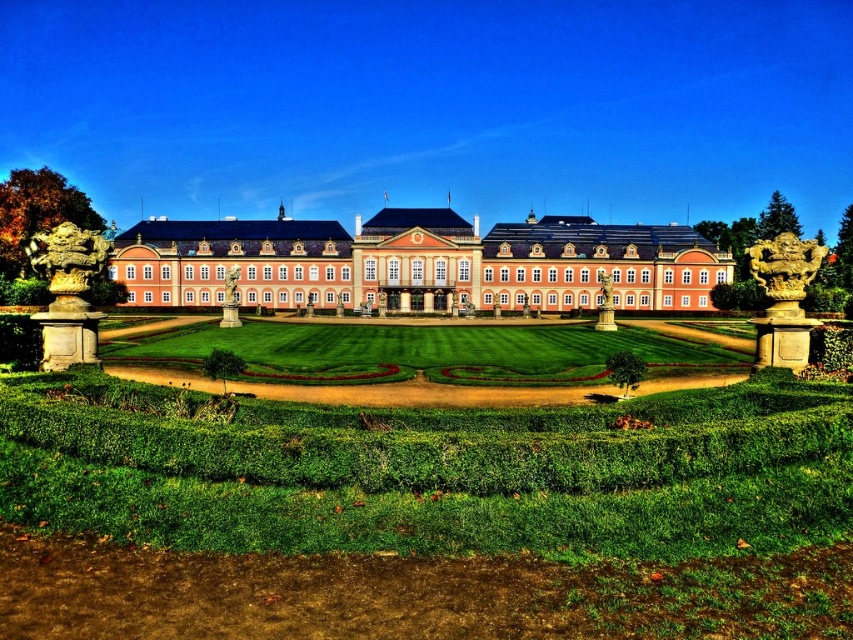
Who is higher up, green grass at center or matte pink building at center?

Positioned higher is matte pink building at center.

Is green grass at center further to the viewer compared to matte pink building at center?

No.

Is point (793, 480) farther from camera compared to point (170, 266)?

No.

The width and height of the screenshot is (853, 640). What are the coordinates of `green grass at center` in the screenshot? It's located at (430, 472).

Can you confirm if matte pink building at center is thinner than green leafy hedge at center?

No, matte pink building at center is not thinner than green leafy hedge at center.

Between matte pink building at center and green leafy hedge at center, which one appears on the right side from the viewer's perspective?

Positioned to the right is green leafy hedge at center.

Which is behind, point (183, 272) or point (740, 296)?

Point (183, 272)

Locate an element on the screen. Image resolution: width=853 pixels, height=640 pixels. matte pink building at center is located at coordinates coord(419,262).

Who is shorter, green grass at center or green leafy hedge at center?

With less height is green leafy hedge at center.

Is point (120, 584) closer to viewer compared to point (750, 296)?

Yes, it is in front of point (750, 296).

This screenshot has width=853, height=640. I want to click on green grass at center, so click(x=430, y=472).